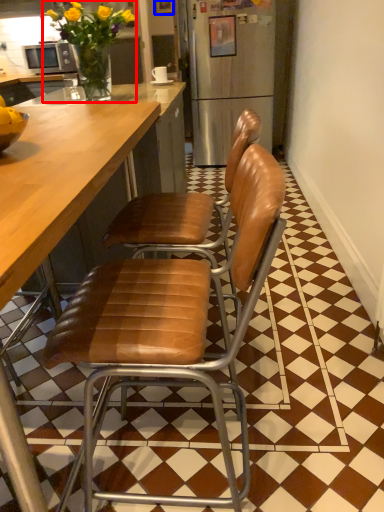
Question: Which object is closer to the camera taking this photo, houseplant (highlighted by a red box) or picture frame (highlighted by a blue box)?

Choices:
 (A) houseplant
 (B) picture frame

Answer: (A)